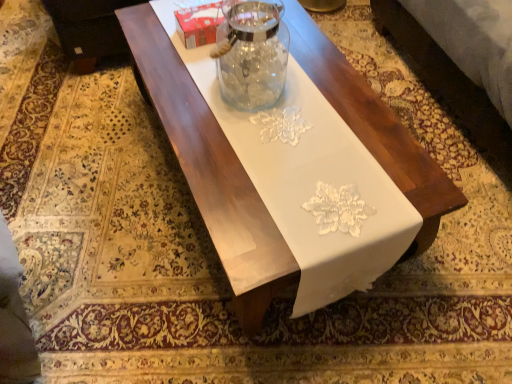
This screenshot has height=384, width=512. What are the coordinates of `vacant area that is situated to the right of transparent glass jar at center` in the screenshot? It's located at (325, 91).